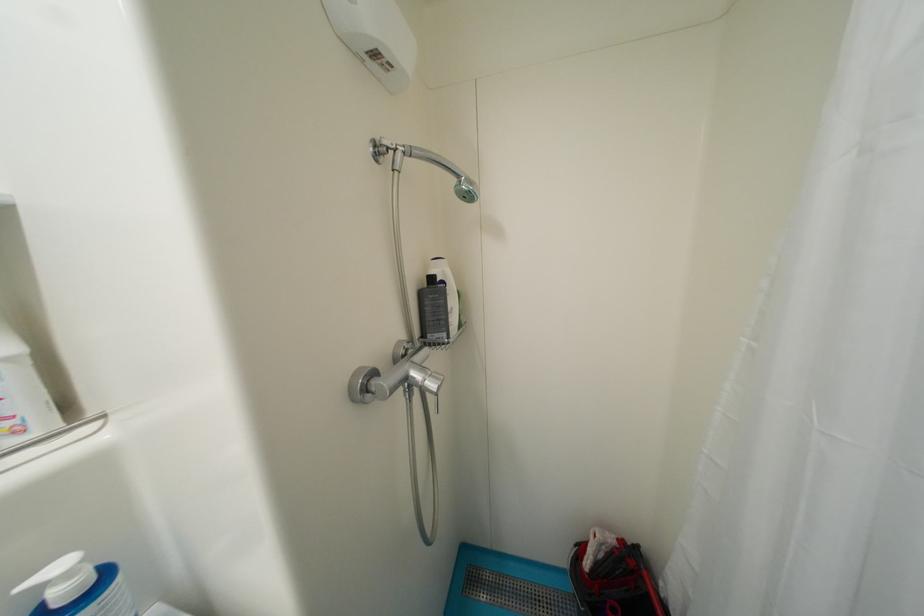
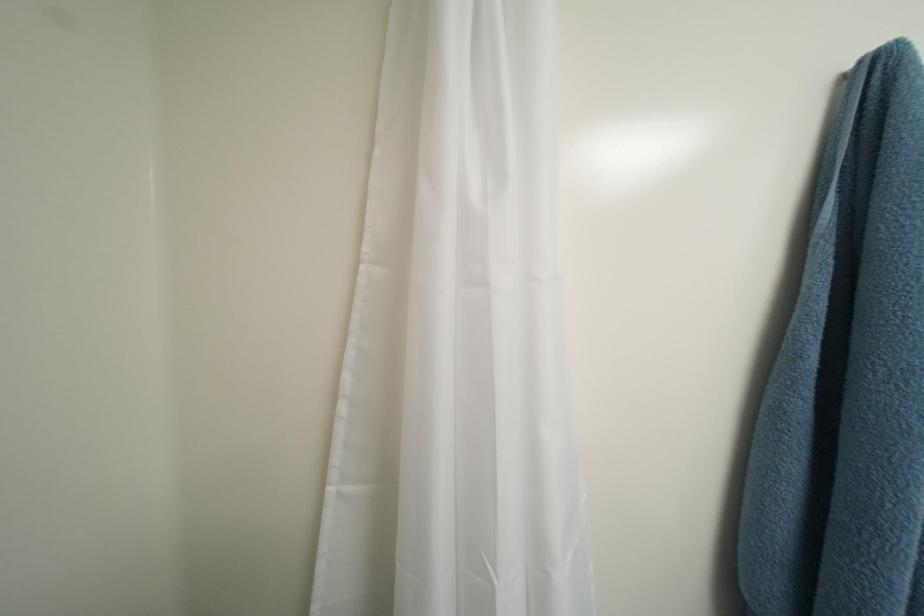
Question: The first image is from the beginning of the video and the second image is from the end. How did the camera likely rotate when shooting the video?

Choices:
 (A) Left
 (B) Right
 (C) Up
 (D) Down

Answer: (B)